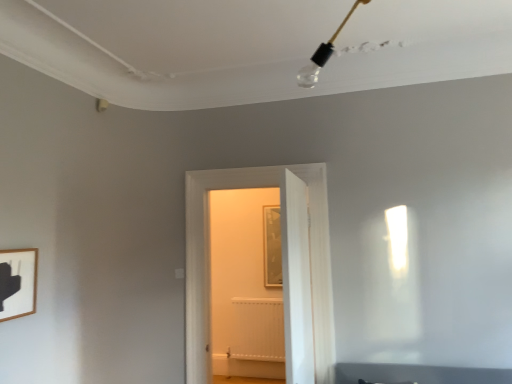
Question: Is white wooden door at center, the 2th door in the front-to-back sequence, to the left or to the right of white wooden door at center, acting as the 2th door starting from the back, in the image?

Choices:
 (A) left
 (B) right

Answer: (A)

Question: Relative to white wooden door at center, acting as the 2th door starting from the back, is white wooden door at center, the 2th door in the front-to-back sequence, in front or behind?

Choices:
 (A) front
 (B) behind

Answer: (B)

Question: Which is nearer to the white matte radiator at center?

Choices:
 (A) white wooden door at center, the 2th door in the front-to-back sequence
 (B) white wooden door at center, acting as the 2th door starting from the back
 (C) wooden picture frame at lower left

Answer: (A)

Question: Estimate the real-world distances between objects in this image. Which object is closer to the white matte radiator at center?

Choices:
 (A) wooden picture frame at lower left
 (B) white wooden door at center, the first door from the front
 (C) white wooden door at center, the first door positioned from the back

Answer: (C)